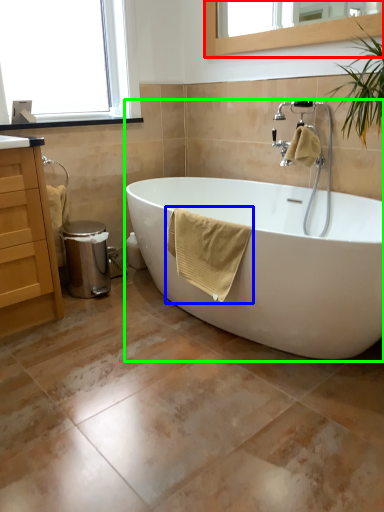
Question: Which object is the closest to the mirror (highlighted by a red box)? Choose among these: bath towel (highlighted by a blue box) or bathtub (highlighted by a green box).

Choices:
 (A) bath towel
 (B) bathtub

Answer: (A)